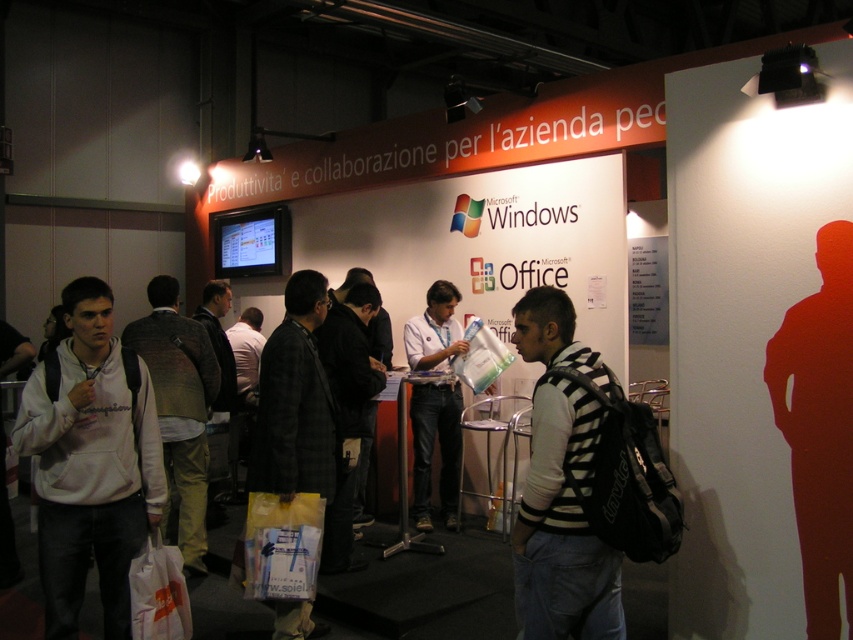
Who is positioned more to the left, black matte shirt at center or light gray sweater at center?

light gray sweater at center is more to the left.

Does point (787, 352) come farther from viewer compared to point (186, 410)?

That is False.

The width and height of the screenshot is (853, 640). Identify the location of black matte shirt at center. (819, 429).

Is black matte shirt at center further to the viewer compared to dark gray jacket at center?

No.

Can you confirm if black matte shirt at center is thinner than dark gray jacket at center?

Correct, black matte shirt at center's width is less than dark gray jacket at center's.

Measure the distance between point (850, 534) and camera.

A distance of 8.76 feet exists between point (850, 534) and camera.

Where is `black matte shirt at center`? black matte shirt at center is located at coordinates (819, 429).

Is white fleece hoodie at left positioned in front of khaki cotton pants at center?

Yes, white fleece hoodie at left is in front of khaki cotton pants at center.

Does white fleece hoodie at left lie behind khaki cotton pants at center?

No, it is not.

The width and height of the screenshot is (853, 640). I want to click on white fleece hoodie at left, so click(90, 461).